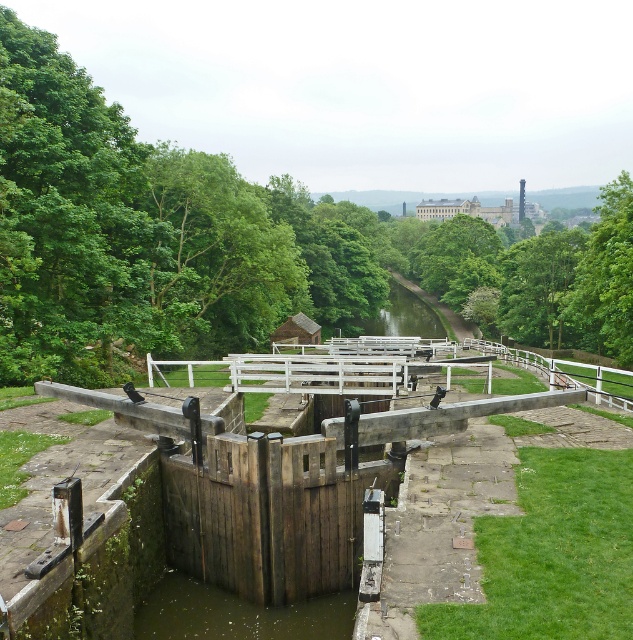
How much distance is there between green leafy tree at upper right and white wooden rail at center-right?

The distance of green leafy tree at upper right from white wooden rail at center-right is 6.21 meters.

Can you confirm if green leafy tree at upper right is positioned to the right of white wooden rail at center-right?

Indeed, green leafy tree at upper right is positioned on the right side of white wooden rail at center-right.

The image size is (633, 640). In order to click on green leafy tree at upper right in this screenshot , I will do `click(605, 275)`.

Is green leafy tree at upper left positioned before white wooden rail at center-right?

No, it is behind white wooden rail at center-right.

Where is `green leafy tree at upper left`? green leafy tree at upper left is located at coordinates (242, 243).

I want to click on green leafy tree at upper left, so click(242, 243).

Between green leafy tree at upper left and green leafy tree at upper right, which one has more height?

green leafy tree at upper left is taller.

Where is `green leafy tree at upper left`? The width and height of the screenshot is (633, 640). green leafy tree at upper left is located at coordinates (242, 243).

I want to click on green leafy tree at upper left, so click(x=242, y=243).